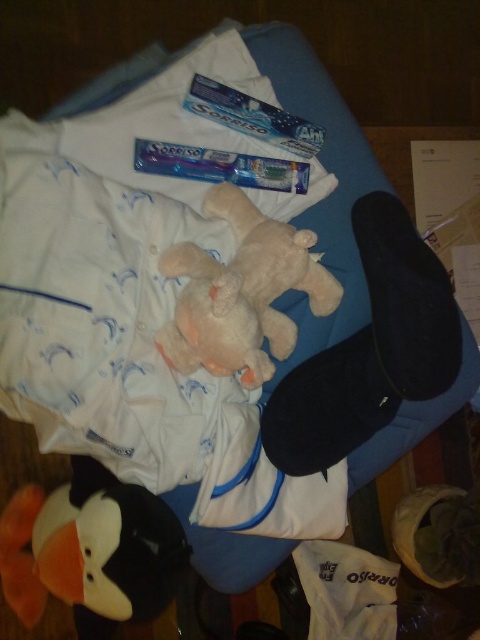
Does fluffy plush penguin at lower left appear over blue glossy toothpaste at center?

No, fluffy plush penguin at lower left is not above blue glossy toothpaste at center.

Locate an element on the screen. Image resolution: width=480 pixels, height=640 pixels. fluffy plush penguin at lower left is located at coordinates (91, 550).

Does fluffy plush penguin at lower left have a greater height compared to fluffy pink stuffed animal at center?

Yes.

Who is higher up, fluffy plush penguin at lower left or fluffy pink stuffed animal at center?

Positioned higher is fluffy pink stuffed animal at center.

Does point (85, 477) lie in front of point (222, 195)?

No, (85, 477) is behind (222, 195).

Find the location of a particular element. fluffy plush penguin at lower left is located at coordinates (91, 550).

Does fluffy plush penguin at lower left have a lesser height compared to blue glossy toothpaste at upper center?

No, fluffy plush penguin at lower left is not shorter than blue glossy toothpaste at upper center.

Which is more to the left, fluffy plush penguin at lower left or blue glossy toothpaste at upper center?

From the viewer's perspective, fluffy plush penguin at lower left appears more on the left side.

Describe the element at coordinates (91, 550) in the screenshot. I see `fluffy plush penguin at lower left` at that location.

At what (x,y) coordinates should I click in order to perform the action: click on fluffy plush penguin at lower left. Please return your answer as a coordinate pair (x, y). The height and width of the screenshot is (640, 480). Looking at the image, I should click on (91, 550).